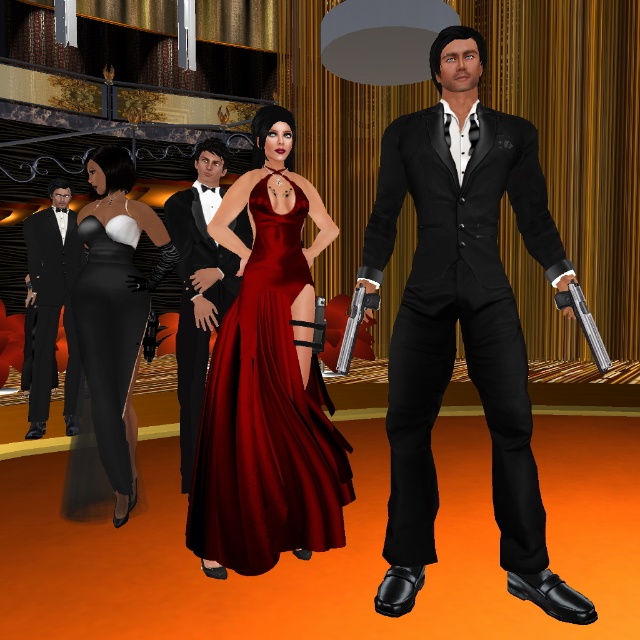
You are a photographer setting up a shoot in this opulent interior. You need to position a camera so that both the matte black suit at center and the matte black dress at left are in frame. Considering their heights, which one might require adjusting the camera angle to ensure both are fully visible?

The matte black suit at center is much taller than the matte black dress at left, so the camera angle may need to be lowered to capture the full height of the taller matte black suit at center while still including the shorter matte black dress at left in the frame.

You are a photographer setting up for a formal event. You need to position a spotlight so it illuminates both the matte black suit at center and the matte black dress at left without causing glare on either. Given their positions, which object should you aim the spotlight towards first to ensure proper lighting?

The matte black suit at center is above the matte black dress at left, so aiming the spotlight towards the matte black suit at center first would ensure proper lighting as it is positioned higher and can cast light downwards towards the dress below.